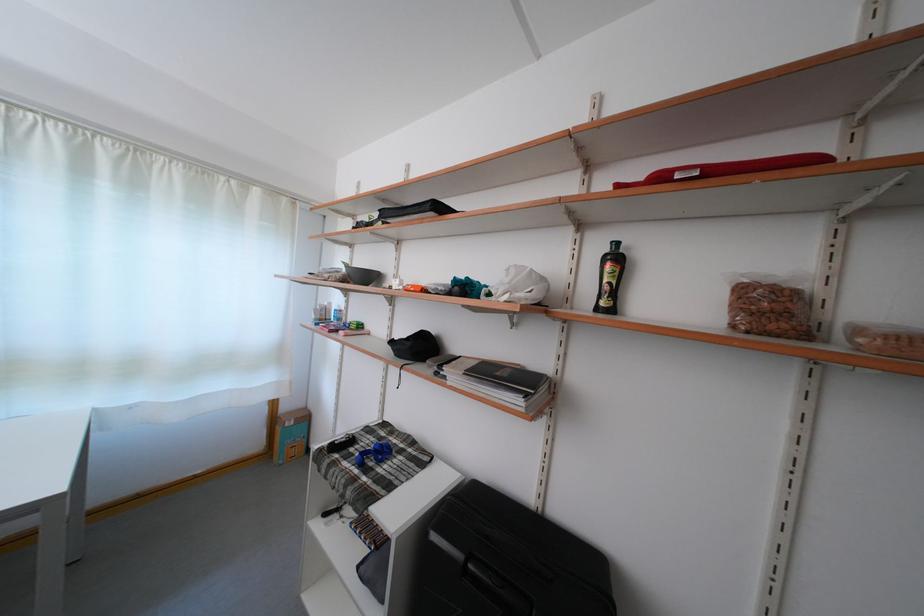
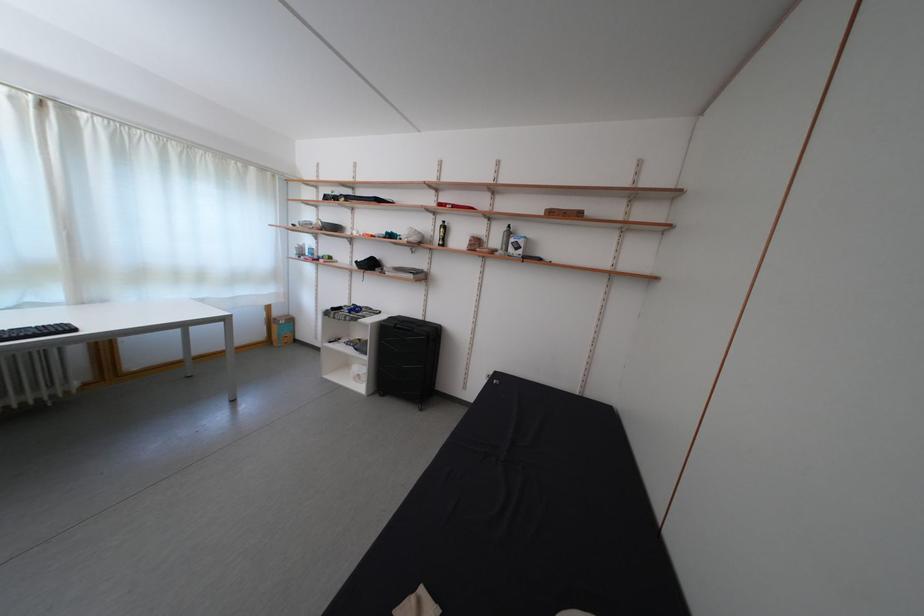
Find the pixel in the second image that matches point 293,415 in the first image.

(285, 320)